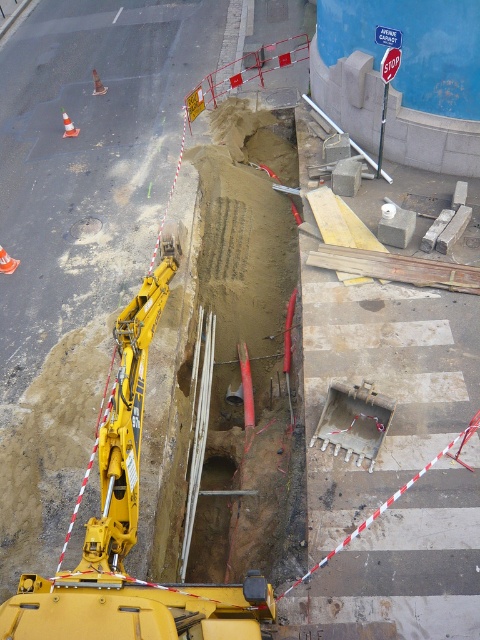
Consider the image. Measure the distance between yellow metallic excavator at center and camera.

4.96 meters

Is yellow metallic excavator at center in front of smooth concrete hole at center?

Yes, it is.

What do you see at coordinates (130, 532) in the screenshot? The image size is (480, 640). I see `yellow metallic excavator at center` at bounding box center [130, 532].

Locate an element on the screen. The height and width of the screenshot is (640, 480). yellow metallic excavator at center is located at coordinates (130, 532).